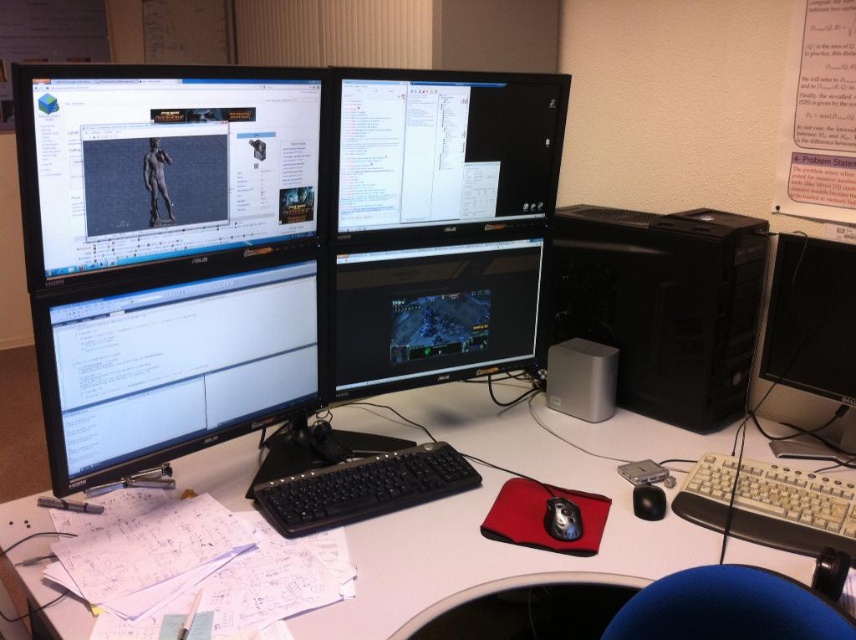
Question: Can you confirm if black plastic desktop at right is smaller than black matte mouse at center?

Choices:
 (A) no
 (B) yes

Answer: (A)

Question: Which object appears closest to the camera in this image?

Choices:
 (A) black plastic keyboard at center
 (B) black matte mouse at center
 (C) matte black monitor at upper left
 (D) black glossy mouse at center

Answer: (C)

Question: Which object appears farthest from the camera in this image?

Choices:
 (A) white plastic computer desk at center
 (B) white plastic keyboard at lower right

Answer: (B)

Question: Does black plastic computer tower at right come in front of matte black monitor at center?

Choices:
 (A) no
 (B) yes

Answer: (A)

Question: Considering the relative positions of white plastic computer desk at center and white plastic keyboard at lower right in the image provided, where is white plastic computer desk at center located with respect to white plastic keyboard at lower right?

Choices:
 (A) above
 (B) below

Answer: (A)

Question: Which point is closer to the camera?

Choices:
 (A) (569, 536)
 (B) (310, 180)

Answer: (A)